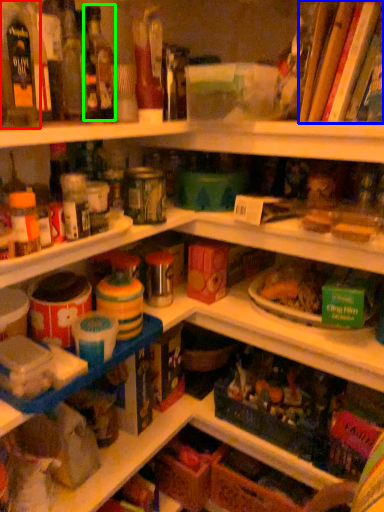
Question: Estimate the real-world distances between objects in this image. Which object is closer to bottle (highlighted by a red box), book (highlighted by a blue box) or bottle (highlighted by a green box)?

Choices:
 (A) book
 (B) bottle

Answer: (B)